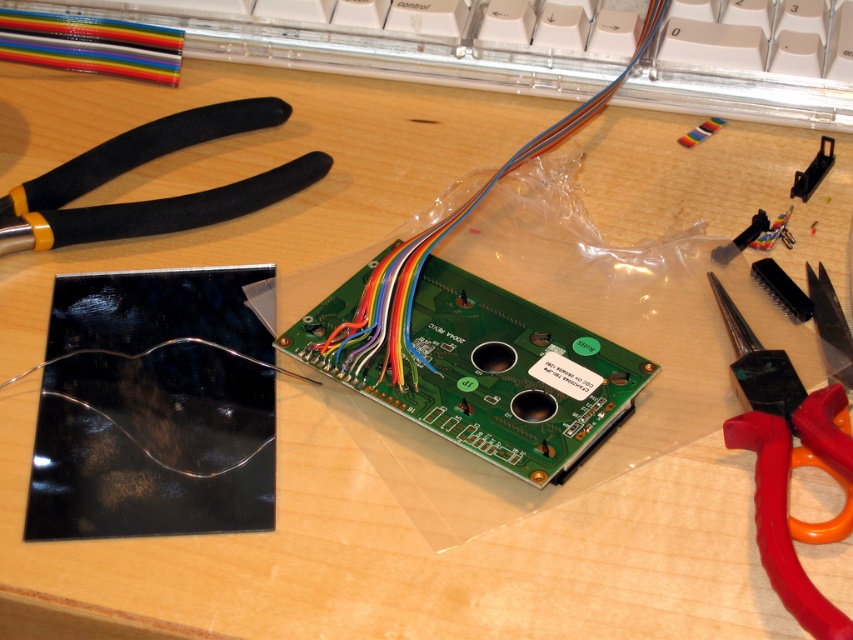
You are an electronics technician working on the PCB. You need to reach for the rainbow cable at center and the black plastic screwdriver at upper right. Which object is taller?

The rainbow cable at center is taller than the black plastic screwdriver at upper right.

You are an electronics technician working on the PCB. You need to cut a wire that is 10 cm away from the black rubberized scissors at upper left. Where should you move the scissors to so that they are exactly 5 cm away from the wire?

Move the black rubberized scissors at upper left to a position 5 cm away from the wire. Since the wire is 10 cm away from the current location of the scissors, moving the scissors halfway towards the wire would place them at 5 cm distance.

From the picture: You are an electronics technician working on the green printed circuit board. You need to cut a wire that is 2 inches thick. The black rubberized scissors at upper left are available. Can you use them to cut the wire?

The black rubberized scissors at upper left is 37.72 inches away from camera, so it is too far to reach and use effectively to cut the wire.